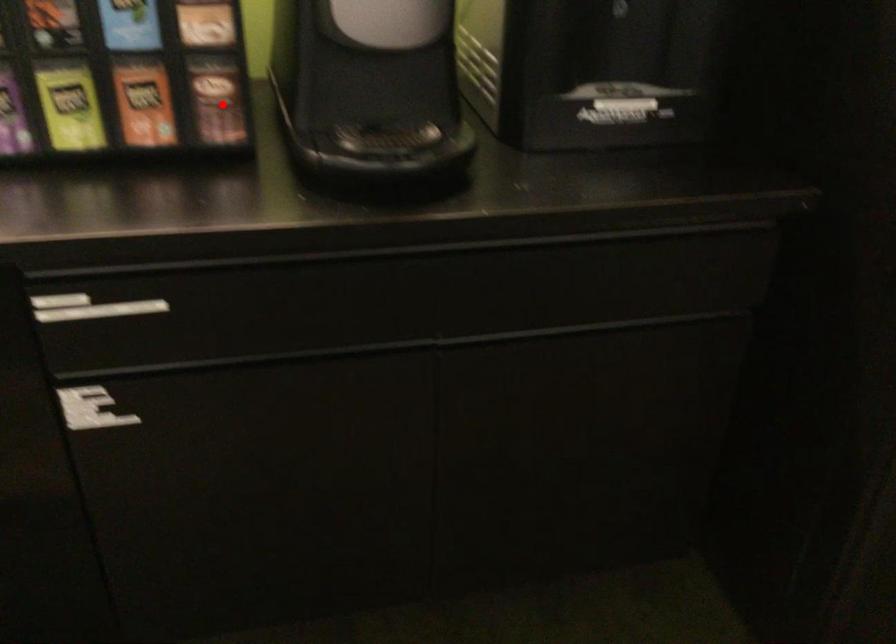
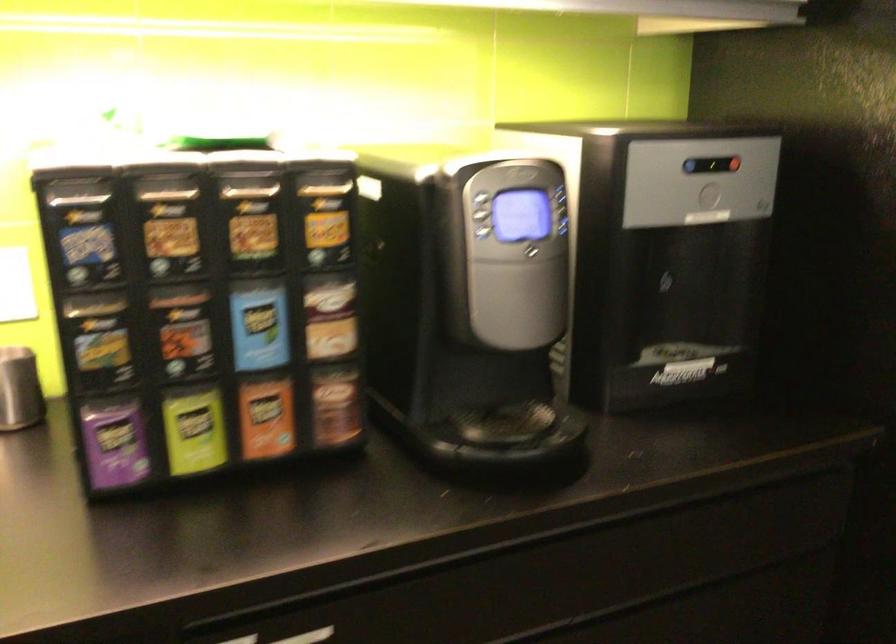
Find the pixel in the second image that matches the highlighted location in the first image.

(336, 406)